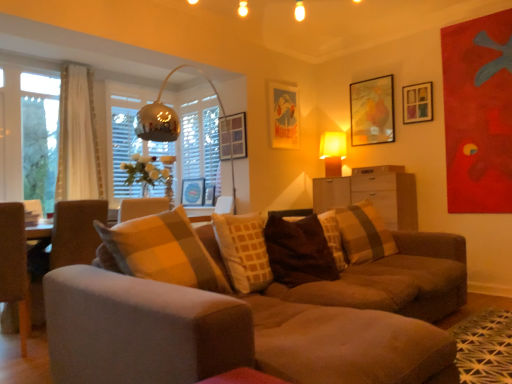
Question: Is matte wooden picture frame at center, which is the 2th picture frame in left-to-right order, to the right of matte paper picture frame at upper center, which is the fourth picture frame in left-to-right order, from the viewer's perspective?

Choices:
 (A) yes
 (B) no

Answer: (B)

Question: Is matte wooden picture frame at center, the 5th picture frame when ordered from right to left, facing away from matte paper picture frame at upper center, which is the fourth picture frame in left-to-right order?

Choices:
 (A) yes
 (B) no

Answer: (B)

Question: Does matte wooden picture frame at center, the 5th picture frame when ordered from right to left, have a smaller size compared to matte paper picture frame at upper center, placed as the third picture frame when sorted from right to left?

Choices:
 (A) no
 (B) yes

Answer: (B)

Question: Does matte wooden picture frame at center, the 5th picture frame when ordered from right to left, lie in front of matte paper picture frame at upper center, placed as the third picture frame when sorted from right to left?

Choices:
 (A) yes
 (B) no

Answer: (B)

Question: From a real-world perspective, is matte wooden picture frame at center, the 5th picture frame when ordered from right to left, beneath matte paper picture frame at upper center, which is the fourth picture frame in left-to-right order?

Choices:
 (A) yes
 (B) no

Answer: (A)

Question: In terms of width, does metallic blue picture frame at center, which is the first picture frame in left-to-right order, look wider or thinner when compared to matte wooden picture frame at center, which is the 2th picture frame in left-to-right order?

Choices:
 (A) thin
 (B) wide

Answer: (B)

Question: From their relative heights in the image, would you say metallic blue picture frame at center, which is the first picture frame in left-to-right order, is taller or shorter than matte wooden picture frame at center, the 5th picture frame when ordered from right to left?

Choices:
 (A) short
 (B) tall

Answer: (B)

Question: From the image's perspective, relative to matte wooden picture frame at center, the 5th picture frame when ordered from right to left, is metallic blue picture frame at center, which is the 6th picture frame in right-to-left order, above or below?

Choices:
 (A) below
 (B) above

Answer: (B)

Question: Relative to matte wooden picture frame at center, the 5th picture frame when ordered from right to left, is metallic blue picture frame at center, which is the first picture frame in left-to-right order, in front or behind?

Choices:
 (A) front
 (B) behind

Answer: (B)

Question: Is yellow fabric lampshade at upper right to the left or to the right of gray fabric swivel chair at left in the image?

Choices:
 (A) right
 (B) left

Answer: (A)

Question: From a real-world perspective, relative to gray fabric swivel chair at left, is yellow fabric lampshade at upper right vertically above or below?

Choices:
 (A) below
 (B) above

Answer: (B)

Question: Is point (339, 137) closer or farther from the camera than point (66, 200)?

Choices:
 (A) farther
 (B) closer

Answer: (A)

Question: Considering the positions of yellow fabric lampshade at upper right and gray fabric swivel chair at left in the image, is yellow fabric lampshade at upper right wider or thinner than gray fabric swivel chair at left?

Choices:
 (A) wide
 (B) thin

Answer: (B)

Question: In terms of size, does white glossy drawer at center appear bigger or smaller than metallic blue picture frame at center, which is the 6th picture frame in right-to-left order?

Choices:
 (A) small
 (B) big

Answer: (B)

Question: From the image's perspective, is white glossy drawer at center located above or below metallic blue picture frame at center, which is the 6th picture frame in right-to-left order?

Choices:
 (A) below
 (B) above

Answer: (B)